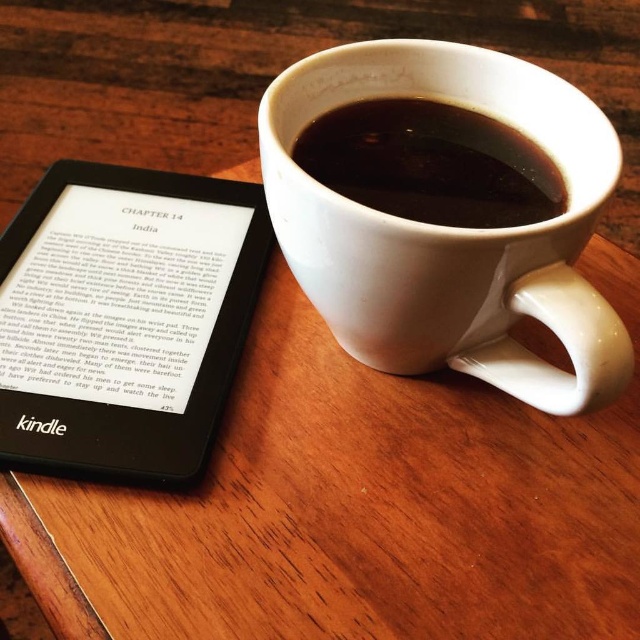
You are a barista trying to place a new coffee cup on the table. The table has limited space between the black matte kindle at left and the black glossy mug at upper center. Can you fit the new cup there if the cup is 10 cm in diameter?

The black matte kindle at left is much taller than the black glossy mug at upper center, so there might not be enough space between them to fit a 10 cm diameter cup. Check the available space carefully before placing the cup.

Based on the photo, you are a delivery robot that needs to place a 6 inch wide package between the black matte kindle at left and the black glossy mug at upper center. Is there enough space between them to fit the package?

The black matte kindle at left and the black glossy mug at upper center are 5.60 inches apart. Since the package is 6 inches wide, which is wider than the space between them, the package cannot fit between them.

You are a barista preparing a latte. You have two mugs on the table. One is the white ceramic mug at upper center and the other is the black glossy mug at upper center. The distance between them is crucial for your workflow. Can you fit a small spoon between them without moving either mug?

The white ceramic mug at upper center is 1.18 inches from the black glossy mug at upper center. A standard small spoon is about 1 inch wide. Since the distance between the mugs is slightly larger than the spoon width, you can fit the spoon between them without moving either mug.